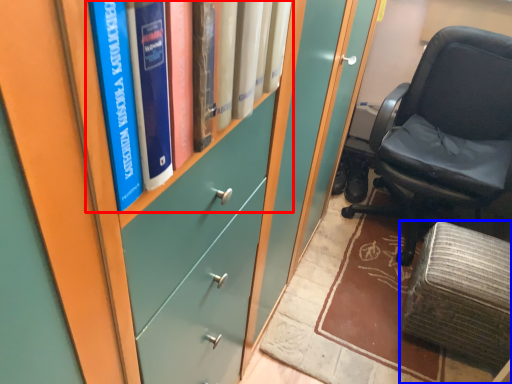
Question: Which object is further to the camera taking this photo, book (highlighted by a red box) or furniture (highlighted by a blue box)?

Choices:
 (A) book
 (B) furniture

Answer: (B)